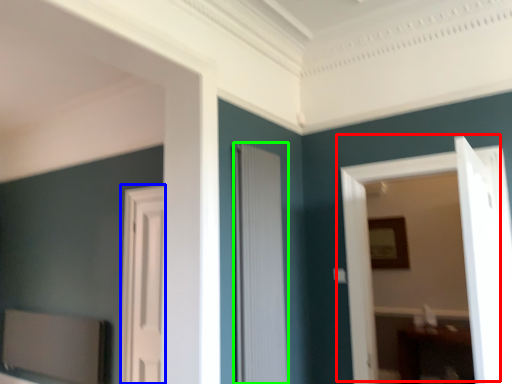
Question: Based on their relative distances, which object is nearer to door (highlighted by a red box)? Choose from door (highlighted by a blue box) and door (highlighted by a green box).

Choices:
 (A) door
 (B) door

Answer: (B)